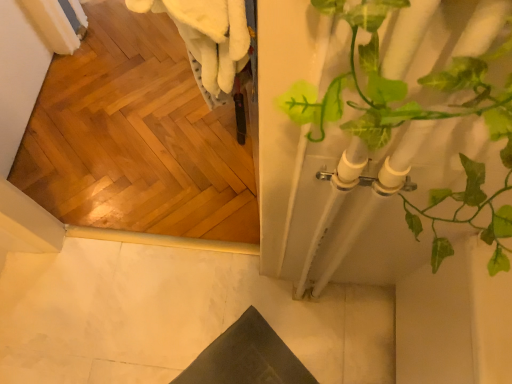
The width and height of the screenshot is (512, 384). In order to click on free point above white marble floor at lower left (from a real-world perspective) in this screenshot , I will do `click(189, 313)`.